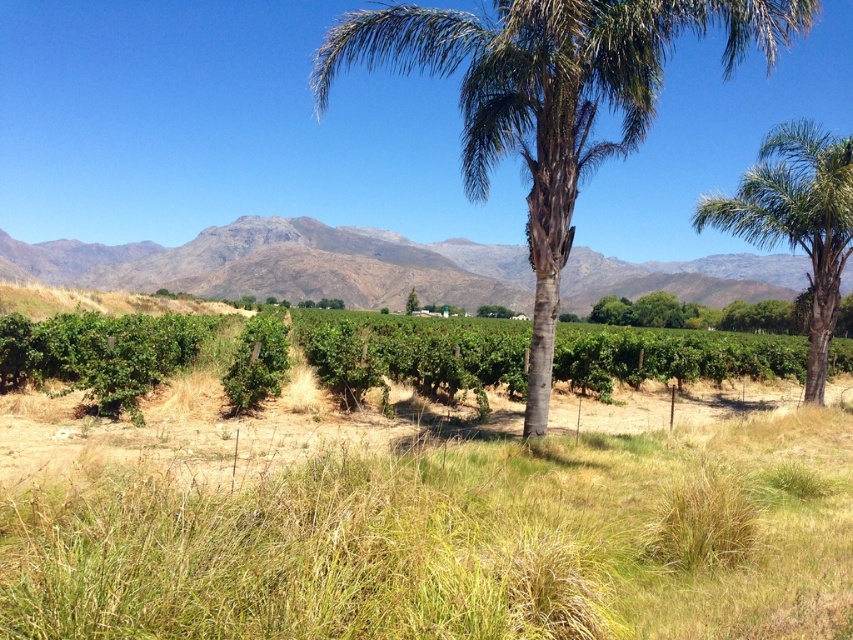
Consider the image. You are standing in the vineyard and notice the gray rocky mountain at center and the green leafy palm tree at center. Which object is positioned to the left when facing the scene?

The gray rocky mountain at center is to the left of the green leafy palm tree at center.

You are planning to install a new fence in your garden. The green leafy hedge at center and the gray rocky mountain at center are both in your view. Which one takes up more space in the image?

The gray rocky mountain at center occupies more space than the green leafy hedge at center.